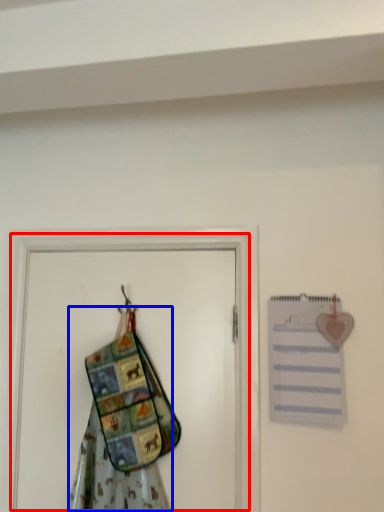
Question: Which of the following is the farthest to the observer, screen door (highlighted by a red box) or fancy dress (highlighted by a blue box)?

Choices:
 (A) screen door
 (B) fancy dress

Answer: (A)